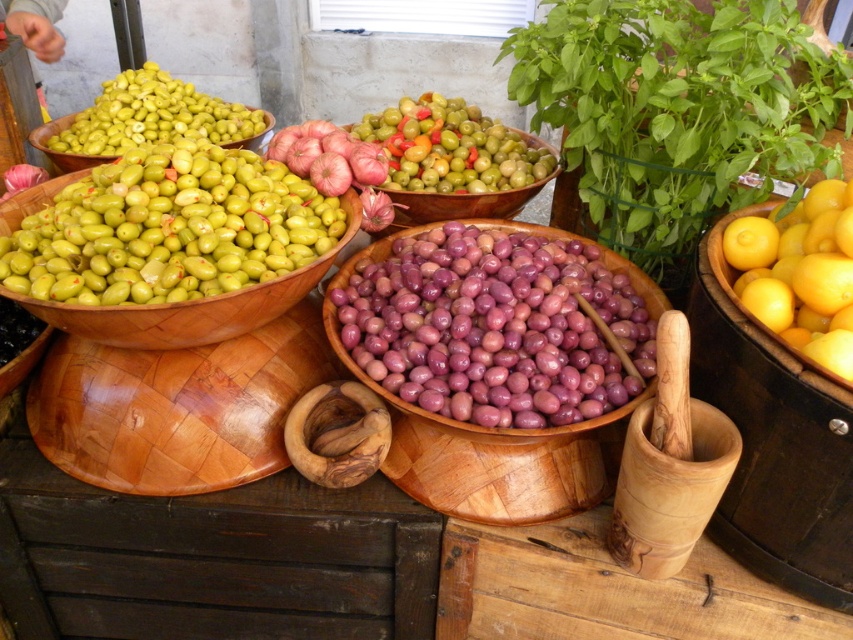
Who is positioned more to the left, green matte olives at left or yellow smooth lemon at right?

From the viewer's perspective, green matte olives at left appears more on the left side.

Does green matte olives at left have a larger size compared to yellow smooth lemon at right?

Yes, green matte olives at left is bigger than yellow smooth lemon at right.

Does point (289, 189) come farther from viewer compared to point (827, 323)?

Yes.

Image resolution: width=853 pixels, height=640 pixels. Find the location of `green matte olives at left`. green matte olives at left is located at coordinates (170, 228).

Is point (827, 204) less distant than point (120, 120)?

Yes.

Does yellow smooth lemon at right appear under matte green olives at upper left?

Yes.

Locate an element on the screen. yellow smooth lemon at right is located at coordinates (799, 273).

Can you confirm if matte green olives at upper left is taller than green olive wood bowl at upper left?

Yes, matte green olives at upper left is taller than green olive wood bowl at upper left.

The height and width of the screenshot is (640, 853). What do you see at coordinates (154, 115) in the screenshot?
I see `matte green olives at upper left` at bounding box center [154, 115].

Locate an element on the screen. matte green olives at upper left is located at coordinates (154, 115).

Locate an element on the screen. Image resolution: width=853 pixels, height=640 pixels. matte green olives at upper left is located at coordinates (154, 115).